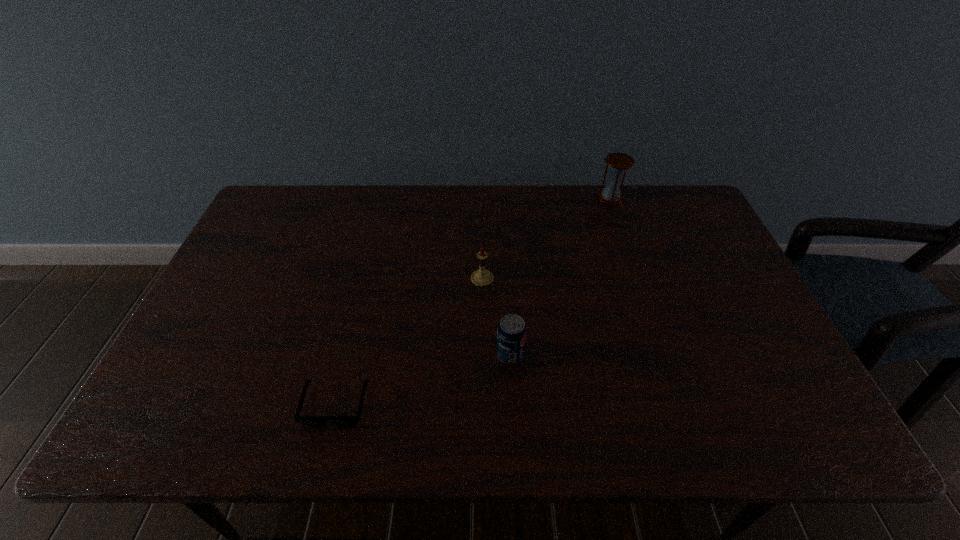
The width and height of the screenshot is (960, 540). In order to click on free space located 0.070m on the back of the second object from right to left in this screenshot , I will do `click(508, 321)`.

I want to click on object situated at the far edge, so click(618, 163).

Locate an element on the screen. This screenshot has height=540, width=960. object positioned at the near edge is located at coordinates click(x=306, y=420).

At what (x,y) coordinates should I click in order to perform the action: click on free space at the far edge of the desktop. Please return your answer as a coordinate pair (x, y). The width and height of the screenshot is (960, 540). Looking at the image, I should click on tap(577, 224).

Locate an element on the screen. vacant space at the near edge of the desktop is located at coordinates (547, 409).

This screenshot has width=960, height=540. In the image, there is a desktop. Find the location of `vacant space at the left edge`. vacant space at the left edge is located at coordinates (244, 350).

In the image, there is a desktop. Where is `vacant space at the right edge`? The height and width of the screenshot is (540, 960). vacant space at the right edge is located at coordinates (757, 345).

I want to click on blank space at the near left corner of the desktop, so click(180, 434).

What are the coordinates of `vacant space at the near right corner of the desktop` in the screenshot? It's located at (791, 417).

Where is `free space between the rightmost object and the second nearest object`? Image resolution: width=960 pixels, height=540 pixels. free space between the rightmost object and the second nearest object is located at coordinates (561, 276).